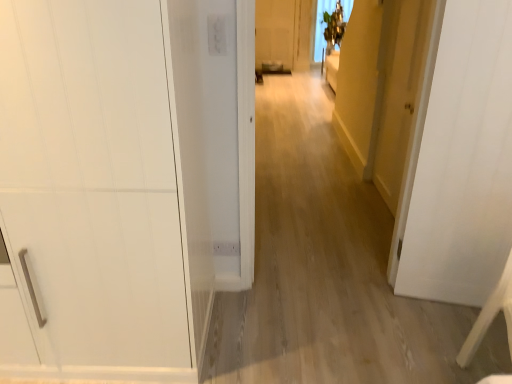
Question: Does yellow matte door at right, marked as the 3th door in a left-to-right arrangement, have a lesser width compared to white matte door at center, marked as the second door in a left-to-right arrangement?

Choices:
 (A) yes
 (B) no

Answer: (A)

Question: Does yellow matte door at right, marked as the 3th door in a left-to-right arrangement, have a greater width compared to white matte door at center, the second door viewed from the right?

Choices:
 (A) no
 (B) yes

Answer: (A)

Question: From a real-world perspective, is yellow matte door at right, the first door when ordered from right to left, on top of white matte door at center, marked as the second door in a left-to-right arrangement?

Choices:
 (A) yes
 (B) no

Answer: (B)

Question: From the image's perspective, is yellow matte door at right, marked as the 3th door in a left-to-right arrangement, over white matte door at center, marked as the second door in a left-to-right arrangement?

Choices:
 (A) no
 (B) yes

Answer: (B)

Question: Is yellow matte door at right, marked as the 3th door in a left-to-right arrangement, directly adjacent to white matte door at center, marked as the second door in a left-to-right arrangement?

Choices:
 (A) yes
 (B) no

Answer: (B)

Question: In the image, is white matte door at center, marked as the second door in a left-to-right arrangement, positioned in front of or behind white matte cabinet at left, the 3th door in the right-to-left sequence?

Choices:
 (A) behind
 (B) front

Answer: (A)

Question: Is white matte door at center, marked as the second door in a left-to-right arrangement, spatially inside white matte cabinet at left, the 3th door in the right-to-left sequence, or outside of it?

Choices:
 (A) outside
 (B) inside

Answer: (A)

Question: Visually, is white matte door at center, marked as the second door in a left-to-right arrangement, positioned to the left or to the right of white matte cabinet at left, acting as the first door starting from the left?

Choices:
 (A) left
 (B) right

Answer: (B)

Question: Is white matte door at center, the second door viewed from the right, wider or thinner than white matte cabinet at left, acting as the first door starting from the left?

Choices:
 (A) wide
 (B) thin

Answer: (B)

Question: Visually, is yellow matte door at right, marked as the 3th door in a left-to-right arrangement, positioned to the left or to the right of white matte door at center, marked as the second door in a left-to-right arrangement?

Choices:
 (A) left
 (B) right

Answer: (B)

Question: Considering the positions of yellow matte door at right, the first door when ordered from right to left, and white matte door at center, the second door viewed from the right, in the image, is yellow matte door at right, the first door when ordered from right to left, taller or shorter than white matte door at center, the second door viewed from the right,?

Choices:
 (A) tall
 (B) short

Answer: (A)

Question: Is yellow matte door at right, the first door when ordered from right to left, spatially inside white matte door at center, the second door viewed from the right, or outside of it?

Choices:
 (A) inside
 (B) outside

Answer: (B)

Question: Is point (422, 51) closer or farther from the camera than point (406, 271)?

Choices:
 (A) farther
 (B) closer

Answer: (B)

Question: From a real-world perspective, is white wood chair at lower right positioned above or below white matte cabinet at left, the 3th door in the right-to-left sequence?

Choices:
 (A) above
 (B) below

Answer: (B)

Question: From the image's perspective, is white wood chair at lower right positioned above or below white matte cabinet at left, acting as the first door starting from the left?

Choices:
 (A) above
 (B) below

Answer: (B)